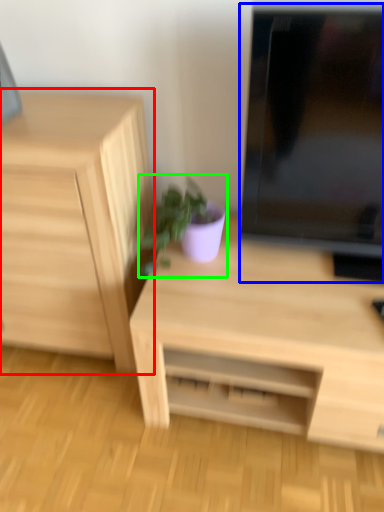
Question: Which object is the closest to the chest of drawers (highlighted by a red box)? Choose among these: computer monitor (highlighted by a blue box) or houseplant (highlighted by a green box).

Choices:
 (A) computer monitor
 (B) houseplant

Answer: (B)